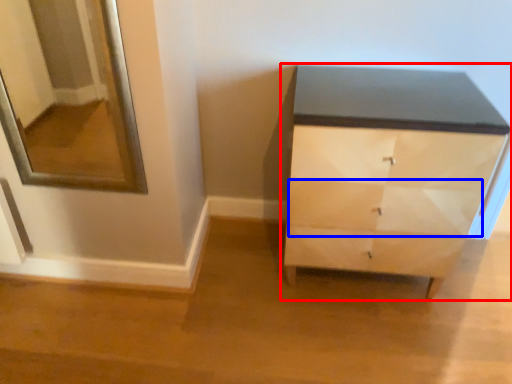
Question: Among these objects, which one is farthest to the camera, chest of drawers (highlighted by a red box) or drawer (highlighted by a blue box)?

Choices:
 (A) chest of drawers
 (B) drawer

Answer: (B)